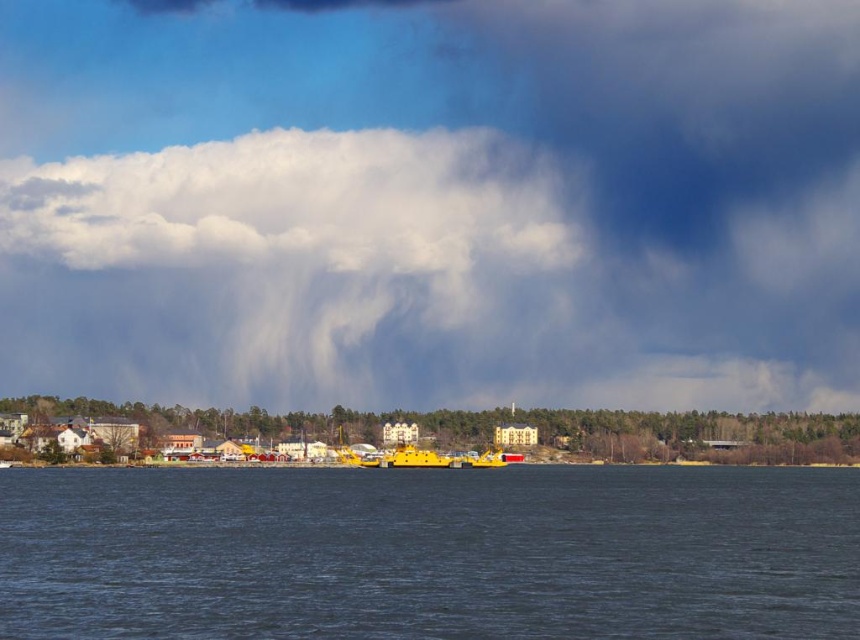
How much distance is there between cloudy sky at upper center and dark blue water at center?

A distance of 216.94 meters exists between cloudy sky at upper center and dark blue water at center.

Who is shorter, cloudy sky at upper center or dark blue water at center?

Standing shorter between the two is dark blue water at center.

The image size is (860, 640). Describe the element at coordinates (432, 202) in the screenshot. I see `cloudy sky at upper center` at that location.

You are a GUI agent. You are given a task and a screenshot of the screen. Output one action in this format:
    pyautogui.click(x=<x>, y=<y>)
    Task: Click on the cloudy sky at upper center
    
    Given the screenshot: What is the action you would take?
    pyautogui.click(x=432, y=202)

Based on the photo, can you confirm if dark blue water at center is positioned to the right of yellow rubber boat at center?

Incorrect, dark blue water at center is not on the right side of yellow rubber boat at center.

Who is higher up, dark blue water at center or yellow rubber boat at center?

dark blue water at center is above.

Is point (662, 598) closer to viewer compared to point (413, 445)?

Yes, point (662, 598) is in front of point (413, 445).

Locate an element on the screen. This screenshot has height=640, width=860. dark blue water at center is located at coordinates (430, 554).

Find the location of `cloudy sky at upper center`. cloudy sky at upper center is located at coordinates (432, 202).

Who is more distant from viewer, (750, 138) or (398, 456)?

The point (750, 138) is more distant.

Find the location of `cloudy sky at upper center`. cloudy sky at upper center is located at coordinates (432, 202).

The height and width of the screenshot is (640, 860). I want to click on cloudy sky at upper center, so click(x=432, y=202).